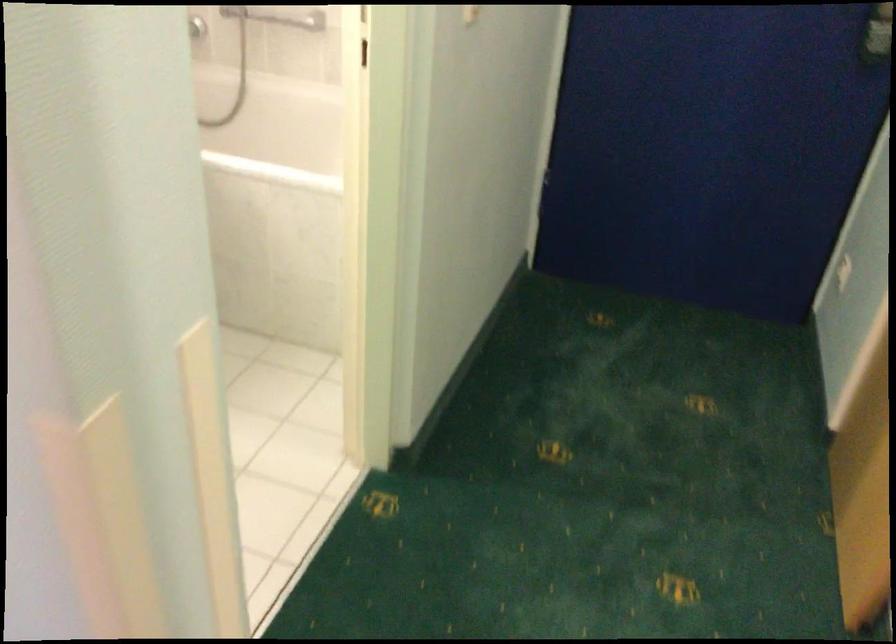
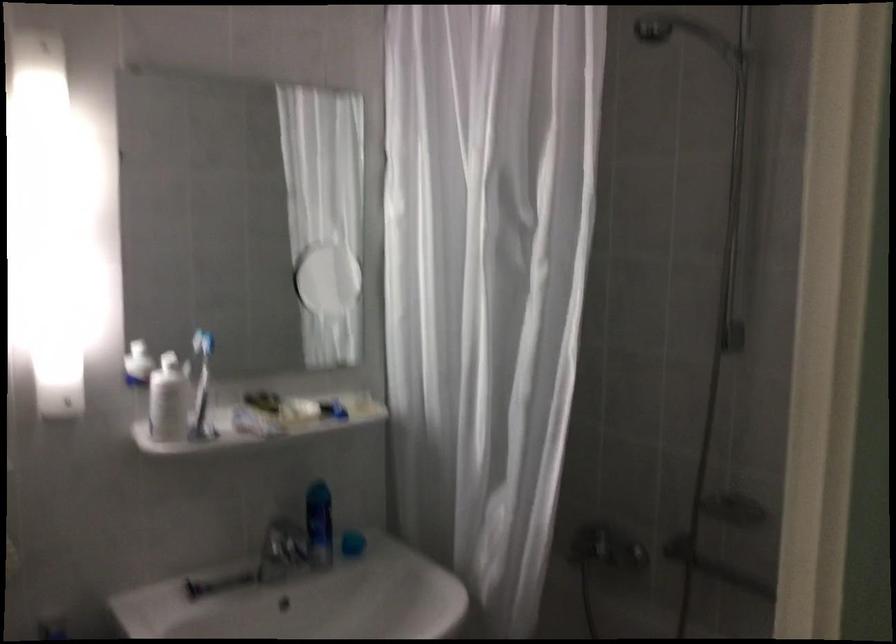
The first image is from the beginning of the video and the second image is from the end. How did the camera likely rotate when shooting the video?

The rotation direction of the camera is left-up.